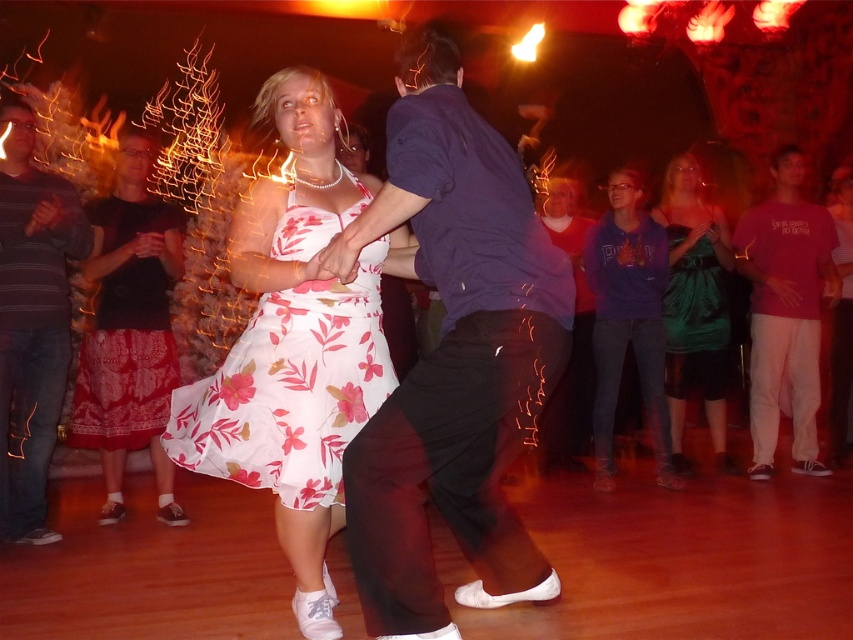
Question: Does white floral fabric dress at center appear over green satin dress at right?

Choices:
 (A) no
 (B) yes

Answer: (A)

Question: Which object appears farthest from the camera in this image?

Choices:
 (A) pink cotton t-shirt at right
 (B) dark blue shirt at center
 (C) green satin dress at right
 (D) white floral fabric dress at center

Answer: (A)

Question: Can you confirm if dark blue shirt at center is bigger than white floral fabric dress at center?

Choices:
 (A) yes
 (B) no

Answer: (A)

Question: Which point is closer to the camera taking this photo?

Choices:
 (A) (155, 380)
 (B) (670, 321)

Answer: (A)

Question: Can you confirm if striped cotton shirt at left is positioned below purple hoodie at center?

Choices:
 (A) yes
 (B) no

Answer: (B)

Question: Which point appears closest to the camera in this image?

Choices:
 (A) (813, 420)
 (B) (712, 211)
 (C) (500, 548)

Answer: (C)